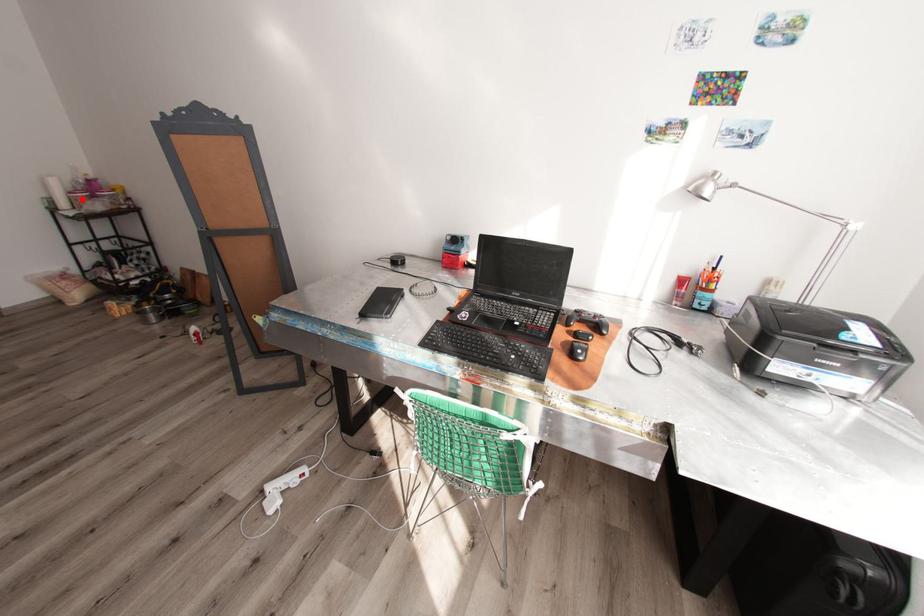
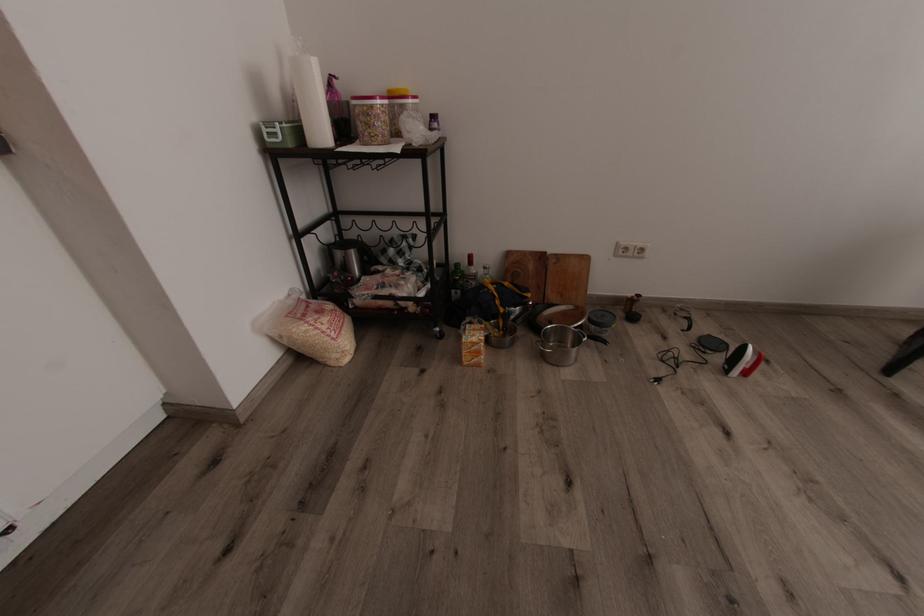
Question: I am providing you with two images of the same scene from different viewpoints. In image1, a red point is highlighted. Considering the same 3D point in image2, which of the following is correct?

Choices:
 (A) It is closer
 (B) It is farther

Answer: (A)